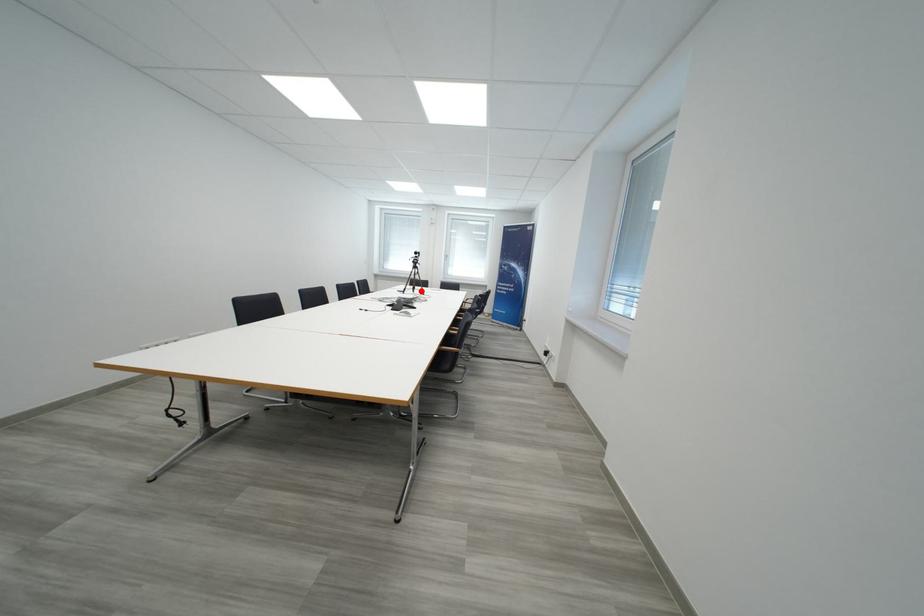
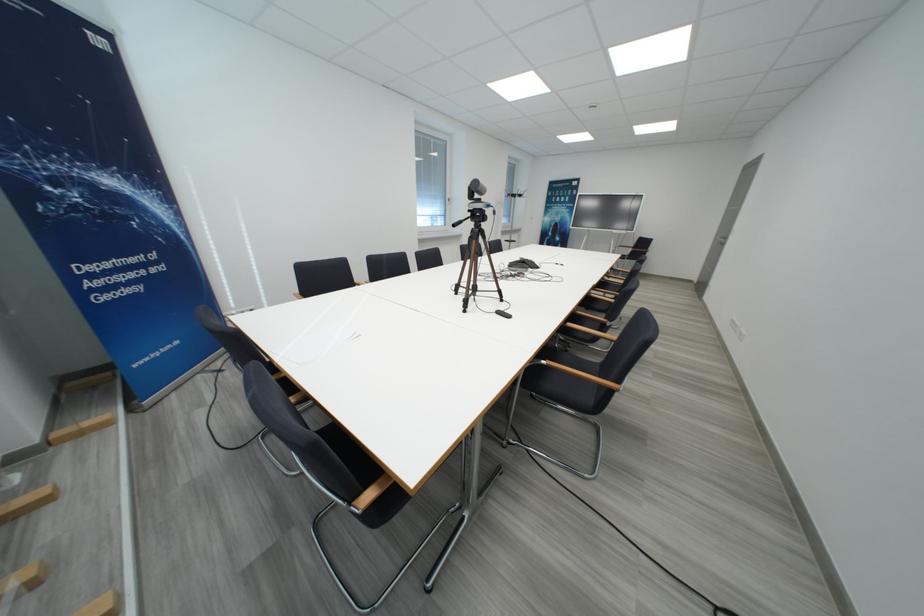
Question: I am providing you with two images of the same scene from different viewpoints. A red point is marked on the first image. Can you still see the location of the red point in image 2?

Choices:
 (A) Yes
 (B) No

Answer: (B)